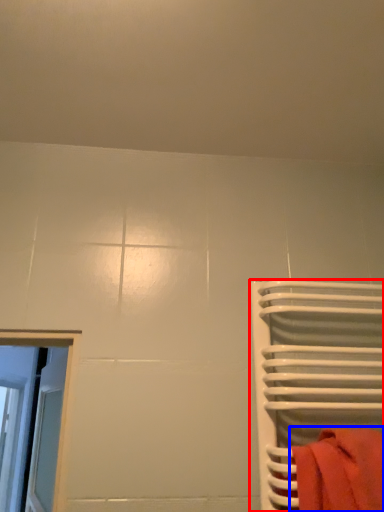
Question: Which point is further to the camera, furniture (highlighted by a red box) or towel (highlighted by a blue box)?

Choices:
 (A) furniture
 (B) towel

Answer: (A)